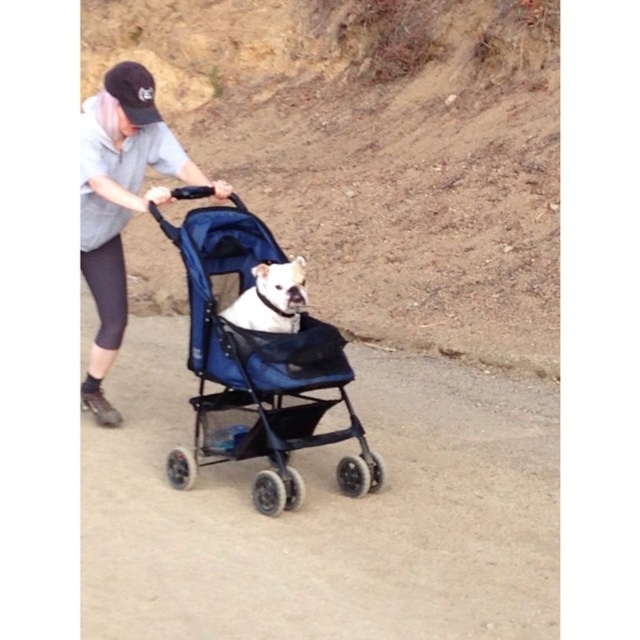
You are a delivery robot that needs to navigate from the black fabric baseball cap at upper left to the blue fabric stroller at center. The robot has a maximum turning radius of 4 feet. Can you safely navigate the path between them?

The distance between the blue fabric stroller at center and the black fabric baseball cap at upper left is 4.53 feet. Since the robot has a maximum turning radius of 4 feet, it cannot safely navigate the path between them as the required turning radius exceeds its capability.

You are a delivery robot with a width of 12 inches. You need to navigate through the area where the blue fabric stroller at center and the white matte dog at center are located. Can you safely pass between them without touching either?

The blue fabric stroller at center is 12.24 inches from the white matte dog at center. Since the robot is 12 inches wide, there is enough space between them for the robot to pass safely without touching either object.

You are a photographer trying to capture a clear shot of the white matte dog at center and the gray fabric shirt at upper left. Which object should you focus on first if you want to ensure both are in focus without adjusting the camera settings?

The gray fabric shirt at upper left is located above the white matte dog at center, so focusing on the gray fabric shirt at upper left first would ensure both are in focus since it is closer to the camera.